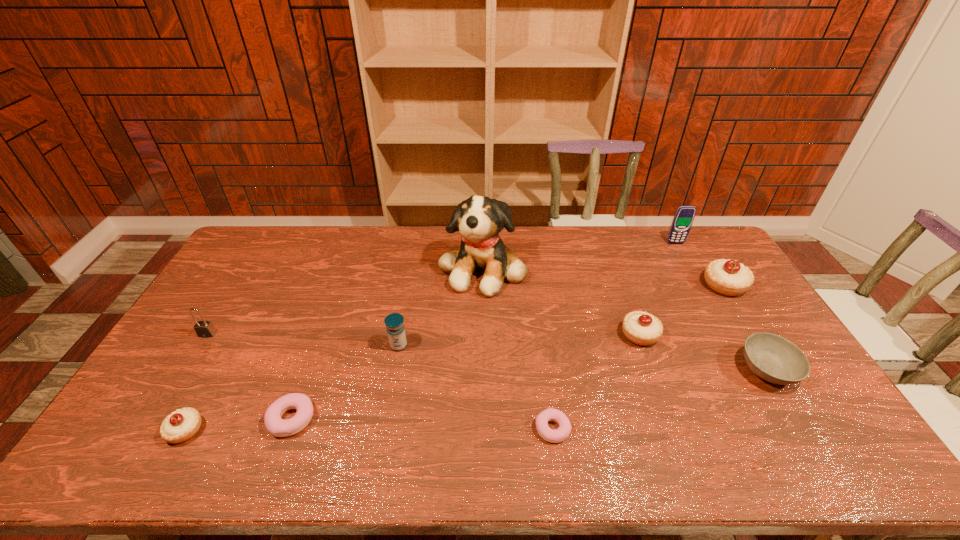
Find the location of a particular element. The height and width of the screenshot is (540, 960). bowl is located at coordinates (773, 358).

At what (x,y) coordinates should I click in order to perform the action: click on the leftmost beige pastry. Please return your answer as a coordinate pair (x, y). This screenshot has width=960, height=540. Looking at the image, I should click on (181, 425).

In order to click on the leftmost pastry in this screenshot , I will do `click(181, 425)`.

In order to click on the bigger pink pastry in this screenshot , I will do `click(278, 427)`.

The width and height of the screenshot is (960, 540). Find the location of `the second shortest object`. the second shortest object is located at coordinates (278, 427).

Find the location of a particular element. the third pastry from right to left is located at coordinates (554, 436).

This screenshot has height=540, width=960. In order to click on the right pink pastry in this screenshot , I will do `click(554, 436)`.

Find the location of `free space located at the face of the puppy`. free space located at the face of the puppy is located at coordinates (483, 331).

At what (x,y) coordinates should I click in order to perform the action: click on free space located 0.190m on the front-facing side of the second tallest object. Please return your answer as a coordinate pair (x, y). This screenshot has width=960, height=540. Looking at the image, I should click on 694,277.

The width and height of the screenshot is (960, 540). In order to click on free spot located on the back of the tallest pastry in this screenshot , I will do `click(708, 261)`.